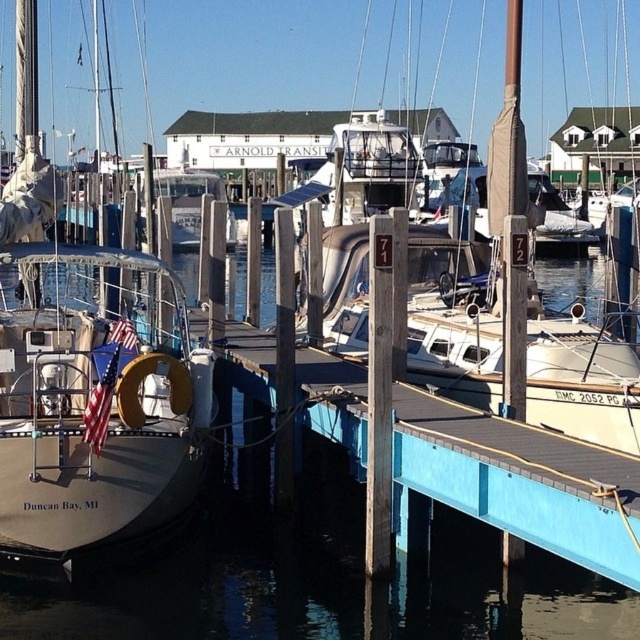
Question: From the image, what is the correct spatial relationship of clear water at dock center in relation to matte white sailboat at left?

Choices:
 (A) left
 (B) right

Answer: (B)

Question: Among these points, which one is nearest to the camera?

Choices:
 (A) (486, 316)
 (B) (58, 620)

Answer: (B)

Question: Considering the real-world distances, which object is closest to the clear water at dock center?

Choices:
 (A) white matte boat at center
 (B) matte white sailboat at left

Answer: (A)

Question: Observing the image, what is the correct spatial positioning of clear water at dock center in reference to white matte boat at center?

Choices:
 (A) right
 (B) left

Answer: (B)

Question: Which point is closer to the camera?

Choices:
 (A) (212, 474)
 (B) (458, 252)
 (C) (93, 380)

Answer: (C)

Question: Is clear water at dock center smaller than matte white sailboat at left?

Choices:
 (A) yes
 (B) no

Answer: (A)